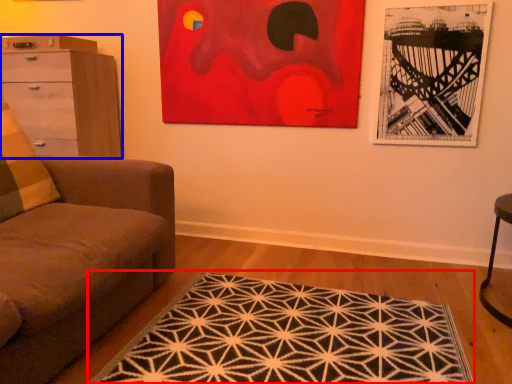
Question: Which object is further to the camera taking this photo, mat (highlighted by a red box) or chest of drawers (highlighted by a blue box)?

Choices:
 (A) mat
 (B) chest of drawers

Answer: (B)